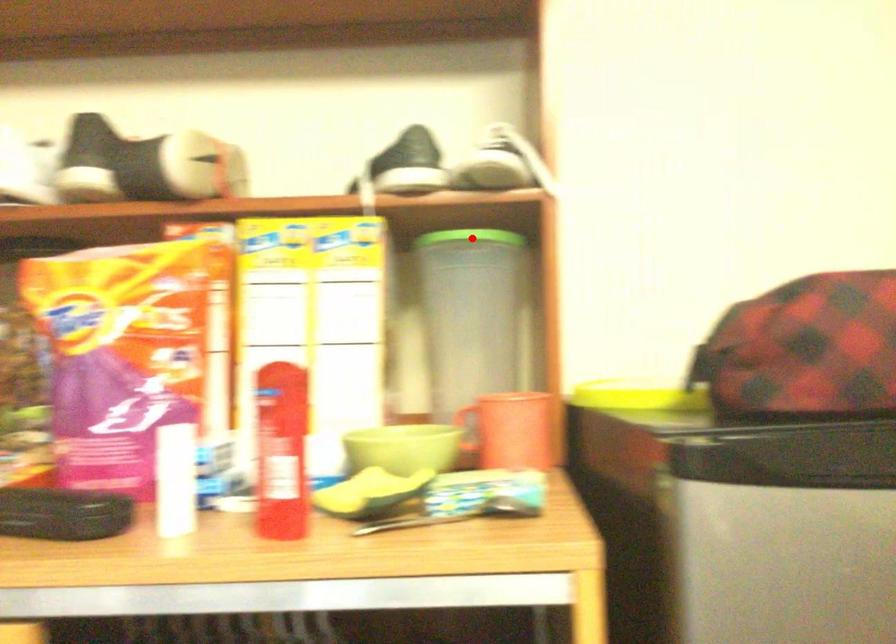
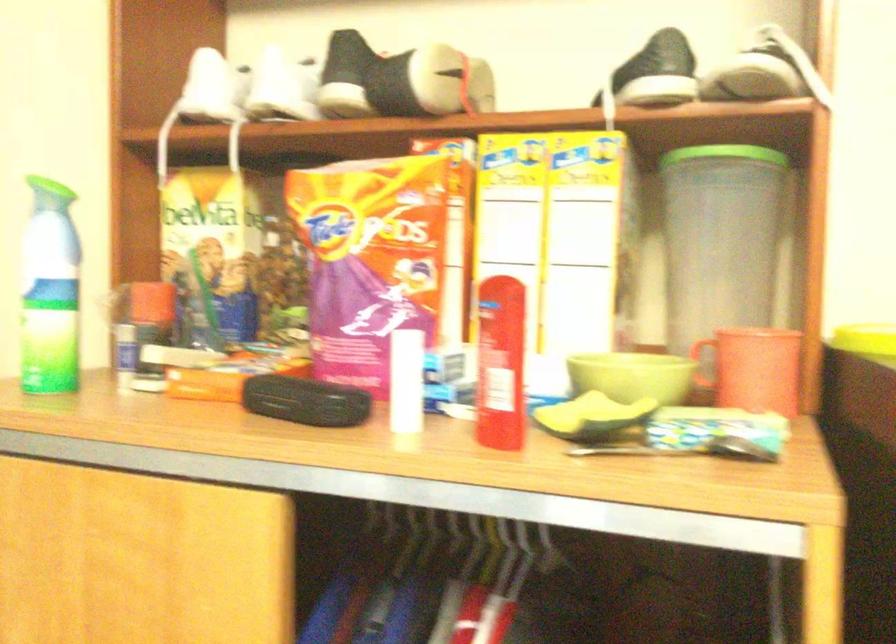
The point at the highlighted location is marked in the first image. Where is the corresponding point in the second image?

(725, 153)